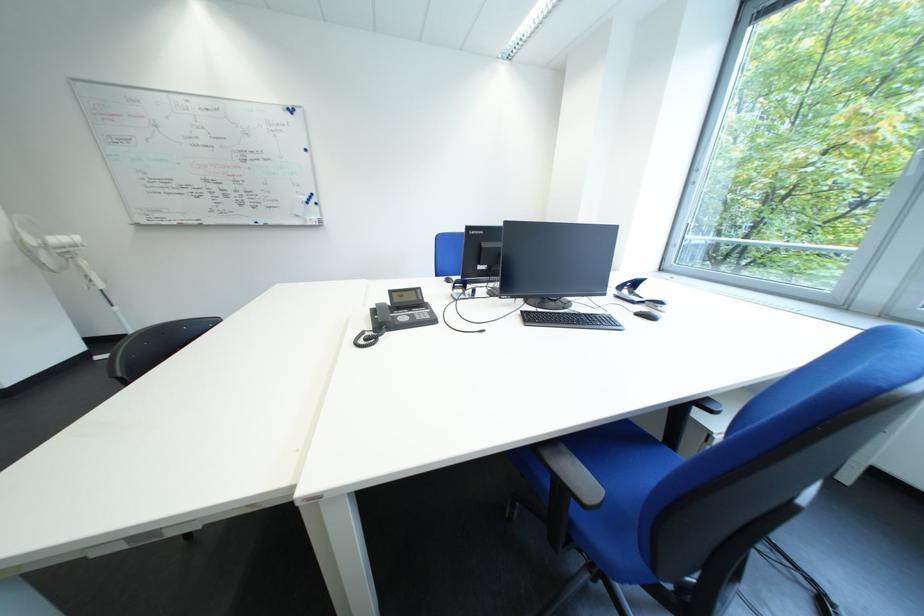
The height and width of the screenshot is (616, 924). In order to click on keyboard key in this screenshot , I will do `click(569, 320)`.